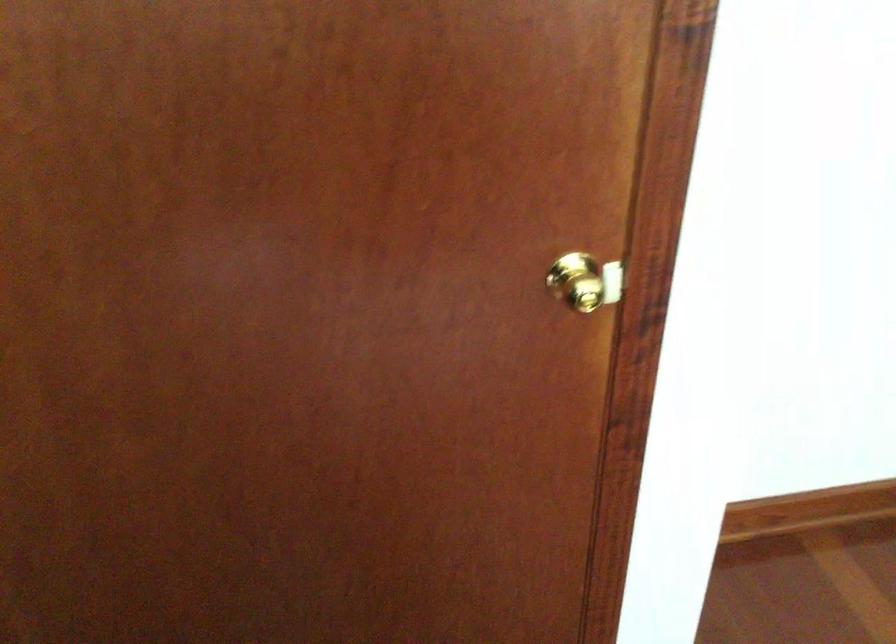
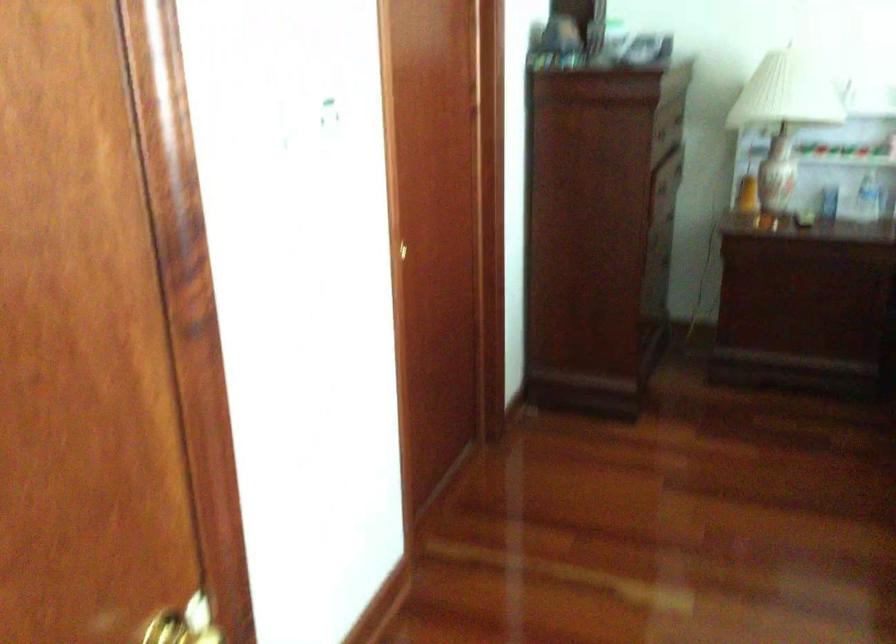
Question: Based on the continuous images, in which direction is the camera rotating? Reply with the corresponding letter.

Choices:
 (A) Left
 (B) Right
 (C) Up
 (D) Down

Answer: (B)